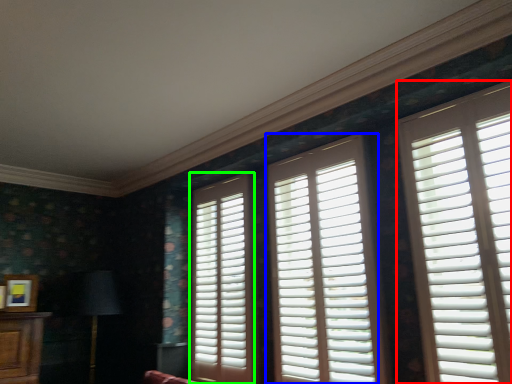
Question: Which object is positioned closest to window (highlighted by a red box)? Select from window (highlighted by a blue box) and window (highlighted by a green box).

Choices:
 (A) window
 (B) window

Answer: (A)